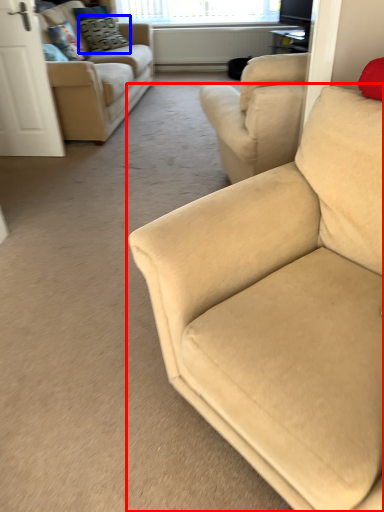
Question: Among these objects, which one is nearest to the camera, studio couch (highlighted by a red box) or pillow (highlighted by a blue box)?

Choices:
 (A) studio couch
 (B) pillow

Answer: (A)